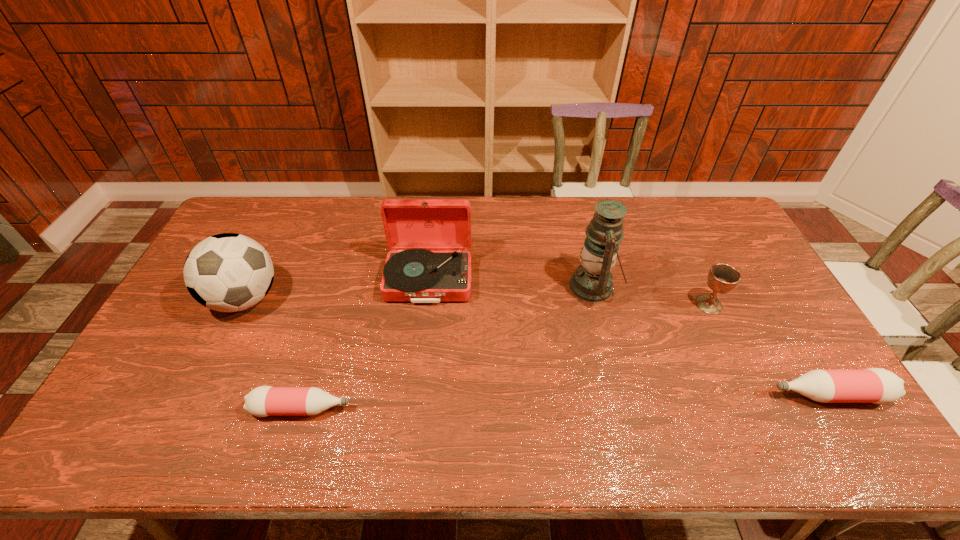
Find the location of a particular element. The height and width of the screenshot is (540, 960). the left bottle is located at coordinates (263, 401).

Locate an element on the screen. Image resolution: width=960 pixels, height=540 pixels. the shortest object is located at coordinates (263, 401).

You are a GUI agent. You are given a task and a screenshot of the screen. Output one action in this format:
    pyautogui.click(x=<x>, y=<y>)
    Task: Click on the right bottle
    Image resolution: width=960 pixels, height=540 pixels.
    Given the screenshot: What is the action you would take?
    pyautogui.click(x=873, y=385)

Find the location of a particular element. Image resolution: width=960 pixels, height=540 pixels. the taller bottle is located at coordinates pos(873,385).

Locate an element on the screen. the fourth tallest object is located at coordinates (722, 278).

I want to click on the fifth object from left to right, so click(722, 278).

This screenshot has width=960, height=540. Identify the location of the third object from right to left. (592, 281).

Identify the location of the tallest object. (592, 281).

What are the coordinates of `the fourth object from right to left` in the screenshot? It's located at (412, 273).

Image resolution: width=960 pixels, height=540 pixels. I want to click on the leftmost object, so (x=228, y=272).